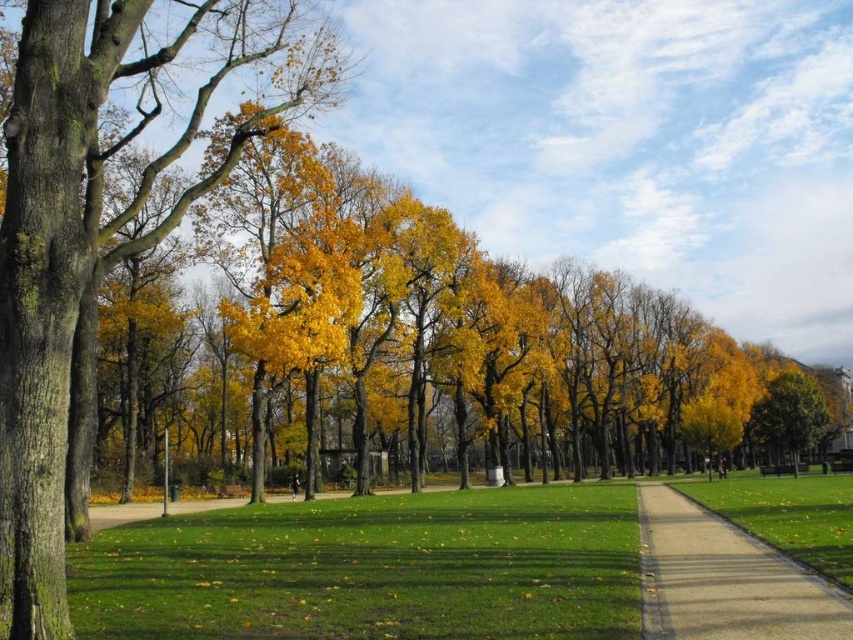
Question: Can you confirm if smooth concrete path at center is positioned to the right of golden yellow leaves at right?

Choices:
 (A) yes
 (B) no

Answer: (B)

Question: Is smooth bark tree at left to the left of golden yellow leaves at right from the viewer's perspective?

Choices:
 (A) yes
 (B) no

Answer: (A)

Question: Among these objects, which one is farthest from the camera?

Choices:
 (A) green grass at center
 (B) golden yellow leaves at right
 (C) smooth bark tree at left

Answer: (B)

Question: Is smooth bark tree at left further to the viewer compared to smooth concrete path at center?

Choices:
 (A) no
 (B) yes

Answer: (A)

Question: Estimate the real-world distances between objects in this image. Which object is farther from the smooth concrete path at center?

Choices:
 (A) golden yellow leaves at right
 (B) smooth bark tree at left

Answer: (A)

Question: Which object appears farthest from the camera in this image?

Choices:
 (A) smooth bark tree at left
 (B) golden yellow leaves at right
 (C) smooth concrete path at center

Answer: (B)